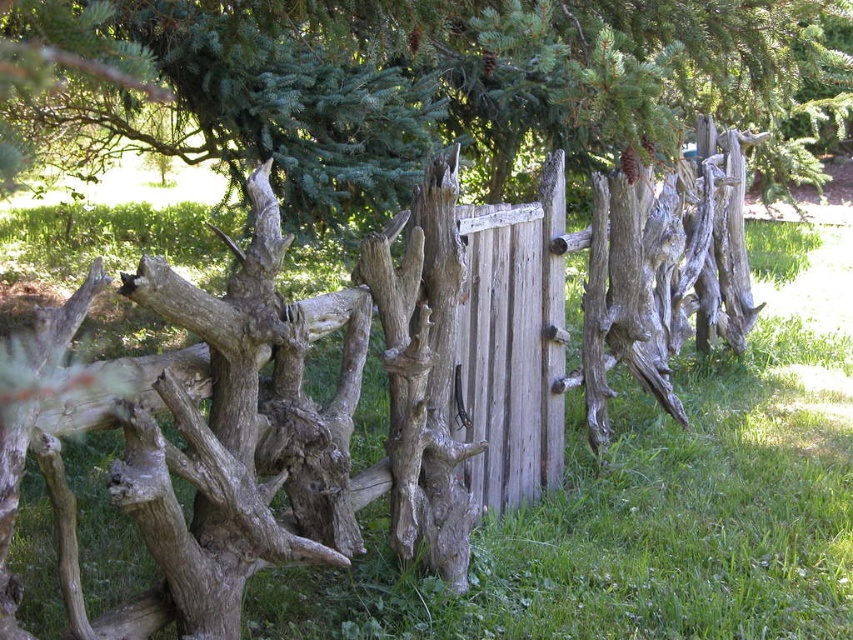
Who is lower down, natural wood fence at center or green textured pine tree at upper center?

natural wood fence at center is below.

Who is positioned more to the right, natural wood fence at center or green textured pine tree at upper center?

natural wood fence at center is more to the right.

Find the location of a particular element. This screenshot has width=853, height=640. natural wood fence at center is located at coordinates (289, 408).